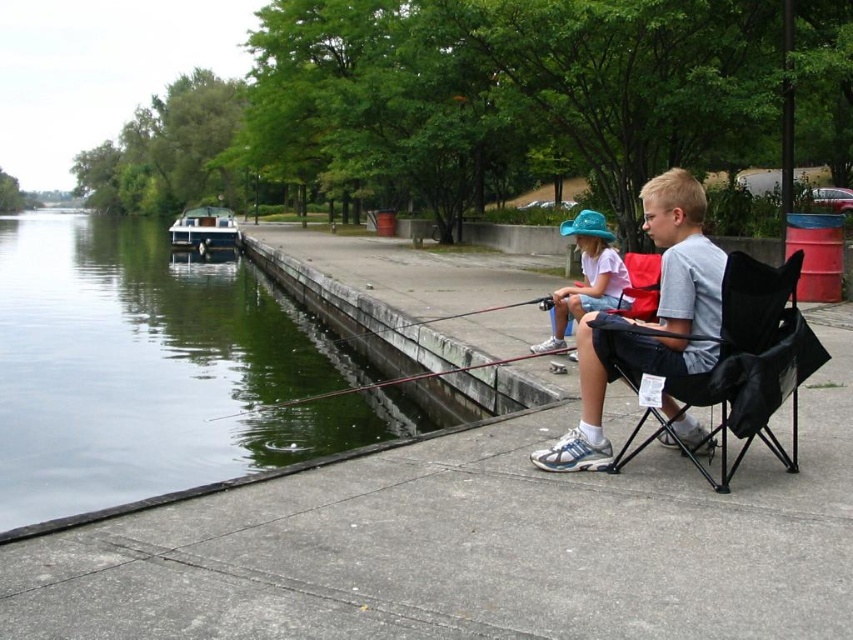
Between green concrete river at lower left and gray fabric chair at center, which one appears on the left side from the viewer's perspective?

green concrete river at lower left is more to the left.

Is green concrete river at lower left wider than gray fabric chair at center?

Yes.

This screenshot has width=853, height=640. I want to click on green concrete river at lower left, so click(x=155, y=371).

Between green concrete river at lower left and smooth black rod at center, which one appears on the left side from the viewer's perspective?

From the viewer's perspective, green concrete river at lower left appears more on the left side.

Is green concrete river at lower left closer to the viewer compared to smooth black rod at center?

Yes, it is.

This screenshot has width=853, height=640. What do you see at coordinates (155, 371) in the screenshot?
I see `green concrete river at lower left` at bounding box center [155, 371].

Locate an element on the screen. Image resolution: width=853 pixels, height=640 pixels. green concrete river at lower left is located at coordinates (155, 371).

Who is taller, green concrete river at lower left or polished wood boat at left?

polished wood boat at left

Image resolution: width=853 pixels, height=640 pixels. In order to click on green concrete river at lower left in this screenshot , I will do click(155, 371).